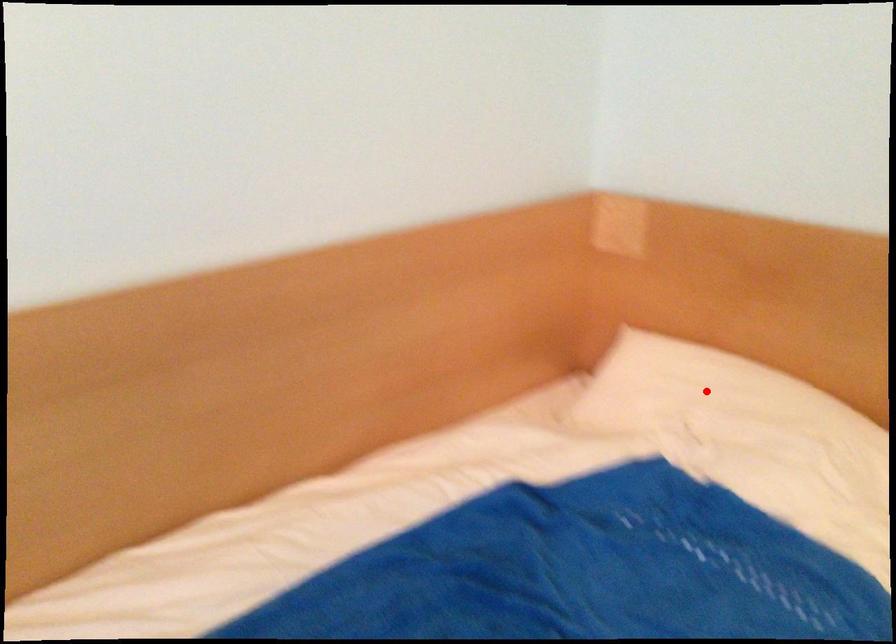
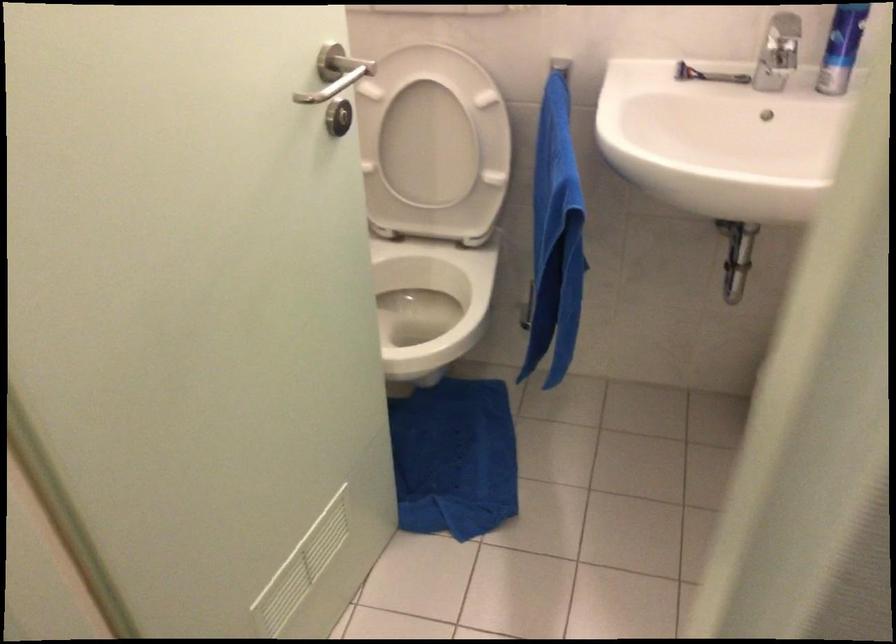
Question: I am providing you with two images of the same scene from different viewpoints. A red point is marked on the first image. Is the red point's position out of view in image 2?

Choices:
 (A) Yes
 (B) No

Answer: (A)